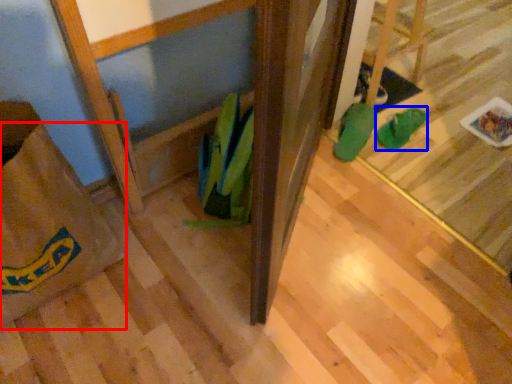
Question: Which point is closer to the camera, grocery bag (highlighted by a red box) or footwear (highlighted by a blue box)?

Choices:
 (A) grocery bag
 (B) footwear

Answer: (A)